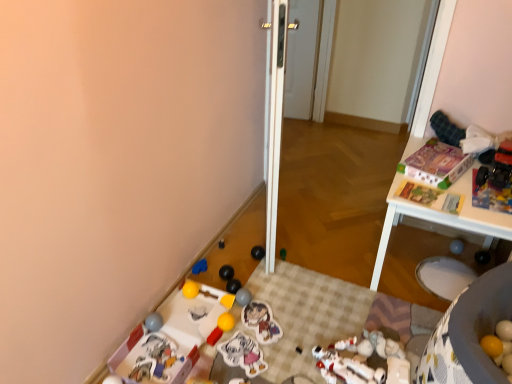
In order to click on empty space that is in between matte plastic sticker at center, placed as the 11th toy when sorted from left to right, and matte gray ball at center, marked as the tenth toy in a left-to-right arrangement in this screenshot , I will do `click(245, 328)`.